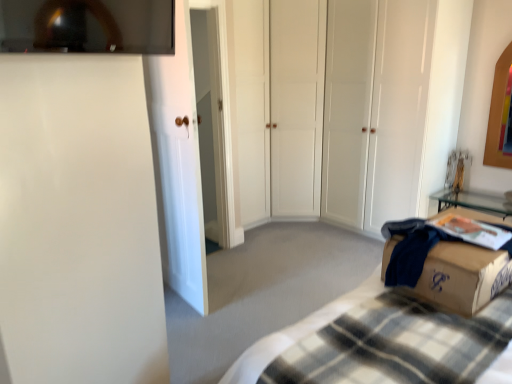
At what (x,y) coordinates should I click in order to perform the action: click on free point above brown cardboard box at lower right (from a real-world perspective). Please return your answer as a coordinate pair (x, y). Looking at the image, I should click on (472, 246).